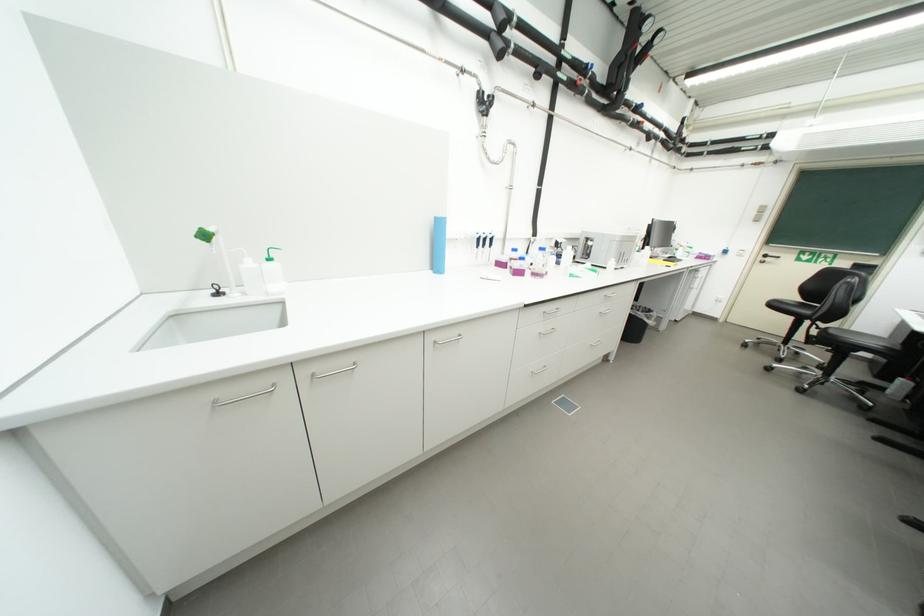
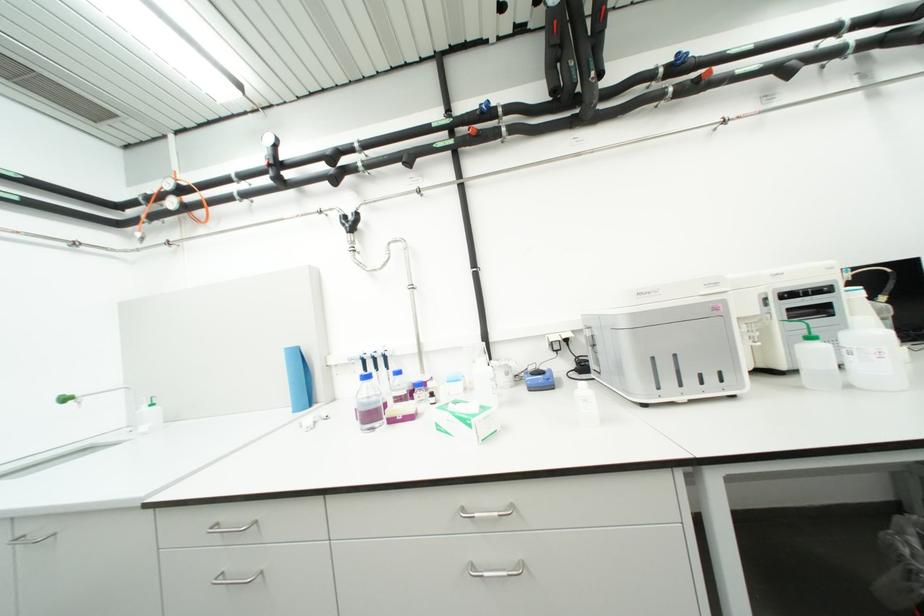
Where in the second image is the point corresponding to the point at 579,277 from the first image?

(446, 429)